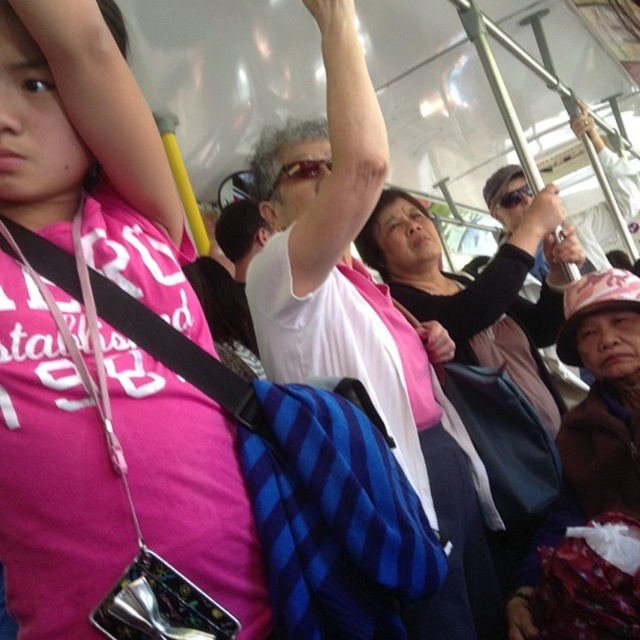
You are a passenger on a bus and you see the pink matte shirt at upper left and the brown fuzzy hat at lower right. Which object is positioned higher in the image?

The pink matte shirt at upper left is located above the brown fuzzy hat at lower right, so it is positioned higher in the image.

You are a passenger on a bus and you see the pink matte shirt at upper left and the brown fuzzy hat at lower right. Which object is closer to you?

The pink matte shirt at upper left is closer to you because it is in front of the brown fuzzy hat at lower right.

You are a passenger on a bus and you see the pink matte shirt at upper left and the brown fuzzy hat at lower right. Which object is taller?

The pink matte shirt at upper left is taller than the brown fuzzy hat at lower right.